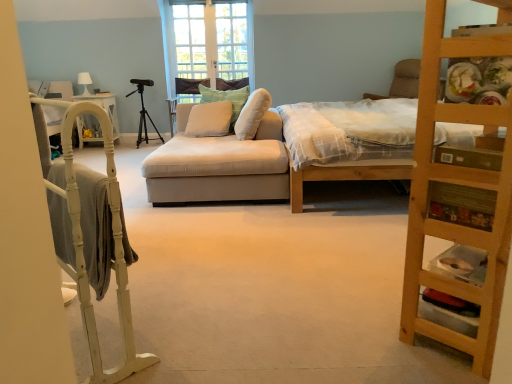
Locate an element on the screen. The height and width of the screenshot is (384, 512). vacant space in between beige fabric couch at center and white painted wood bunk bed at left is located at coordinates (189, 246).